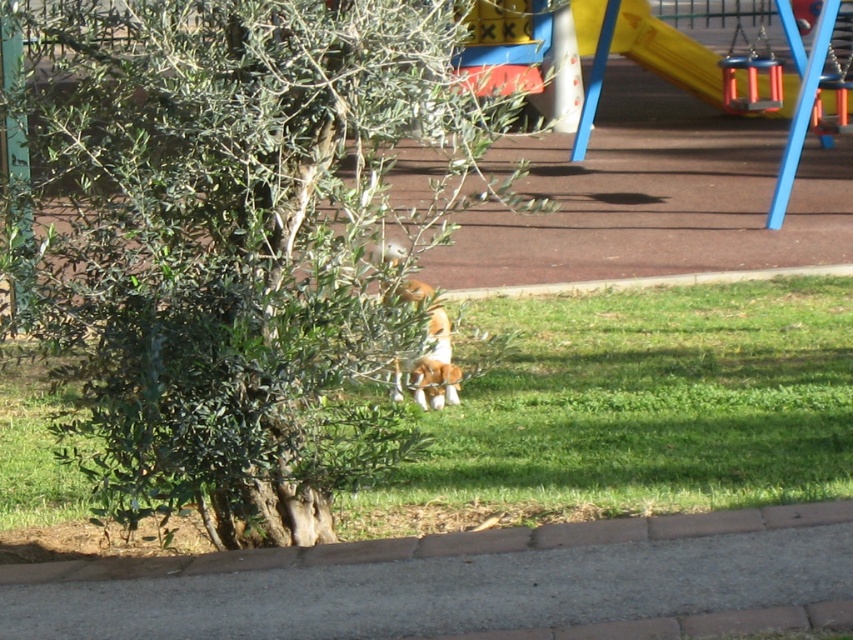
You are standing in the park and see the green grass at center and the brown fur dog at center. Which object is located to the right of the other?

The green grass at center is positioned on the right side of brown fur dog at center.

You are standing in the park and see the green leafy tree at center and the green grass at center. Which one is more to the left?

The green leafy tree at center is positioned on the left side of green grass at center, so it is more to the left.